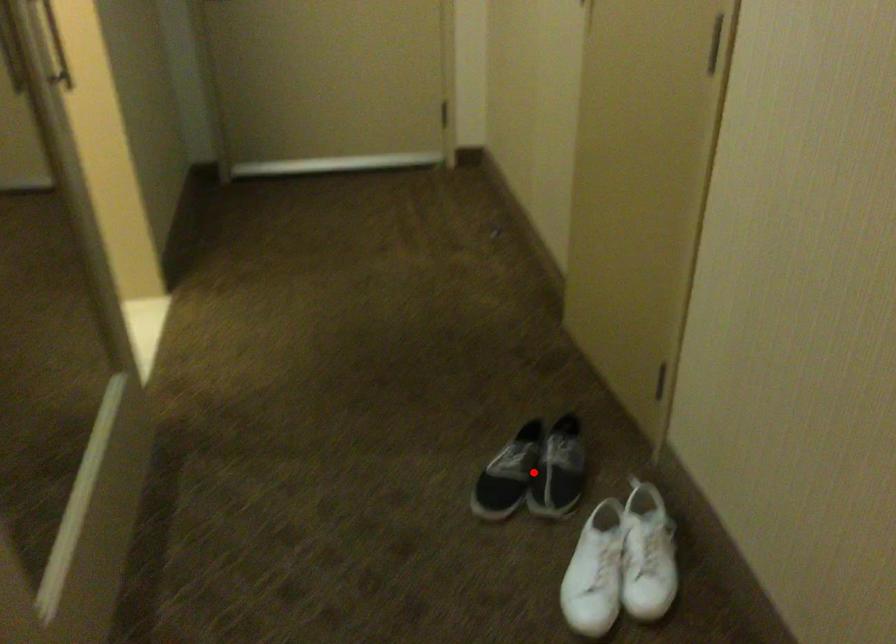
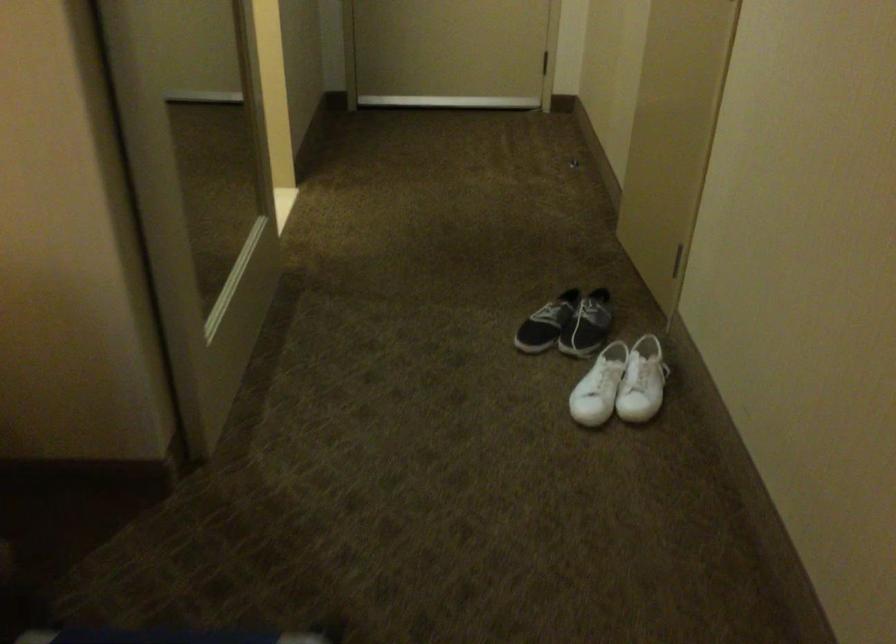
Question: I am providing you with two images of the same scene from different viewpoints. Given a red point in image1, look at the same physical point in image2. Is it:

Choices:
 (A) Closer to the viewpoint
 (B) Farther from the viewpoint

Answer: (B)